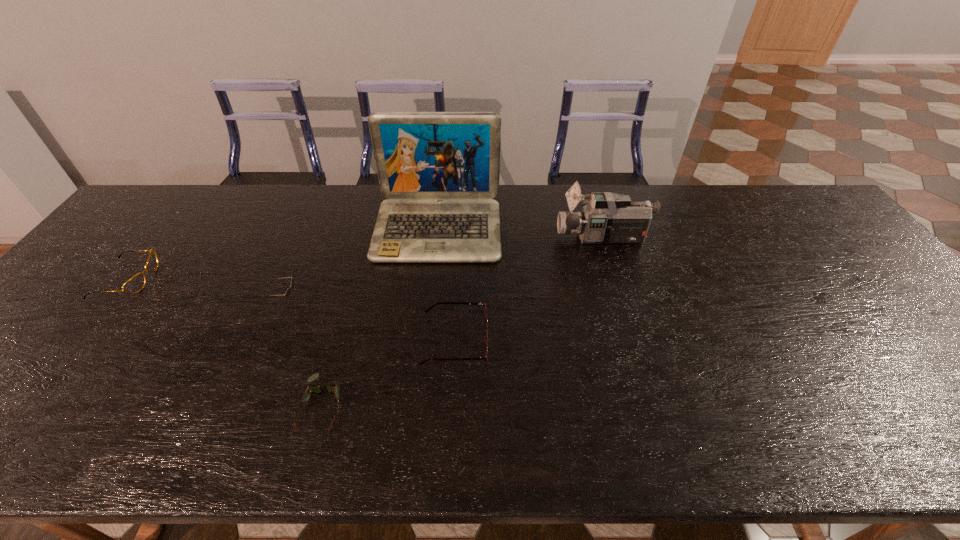
Locate an element on the screen. vacant area that lies between the third tallest object and the camcorder is located at coordinates (444, 269).

Where is `free spot between the farthest spectacles and the rightmost object`? The width and height of the screenshot is (960, 540). free spot between the farthest spectacles and the rightmost object is located at coordinates (365, 259).

Where is `unoccupied position between the second farthest spectacles and the laptop computer`? This screenshot has height=540, width=960. unoccupied position between the second farthest spectacles and the laptop computer is located at coordinates (446, 285).

I want to click on vacant space that's between the rightmost spectacles and the fifth object from right to left, so click(x=371, y=321).

This screenshot has height=540, width=960. What are the coordinates of `vacant area that lies between the second nearest spectacles and the laptop computer` in the screenshot? It's located at (446, 285).

Where is `blank region between the leftmost spectacles and the laptop computer`? This screenshot has width=960, height=540. blank region between the leftmost spectacles and the laptop computer is located at coordinates (282, 254).

Identify which object is the second closest to the rightmost spectacles. Please provide its 2D coordinates. Your answer should be formatted as a tuple, i.e. [(x, y)], where the tuple contains the x and y coordinates of a point satisfying the conditions above.

[(439, 170)]

Locate which object is the second closest to the nearest object. Please provide its 2D coordinates. Your answer should be formatted as a tuple, i.e. [(x, y)], where the tuple contains the x and y coordinates of a point satisfying the conditions above.

[(288, 292)]

Where is `the closest spectacles to the nearest spectacles`? The image size is (960, 540). the closest spectacles to the nearest spectacles is located at coordinates (485, 357).

Find the location of a particular element. spectacles that is the nearest to the leftmost object is located at coordinates (332, 388).